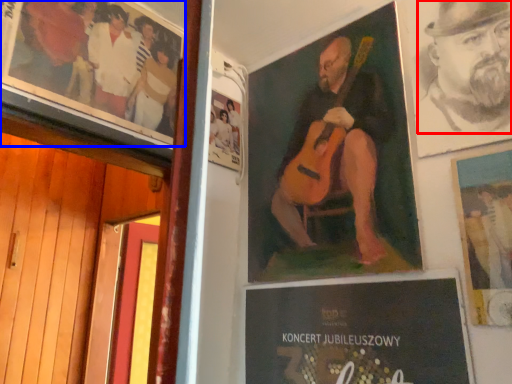
Question: Which object is further to the camera taking this photo, person (highlighted by a red box) or poster (highlighted by a blue box)?

Choices:
 (A) person
 (B) poster

Answer: (B)